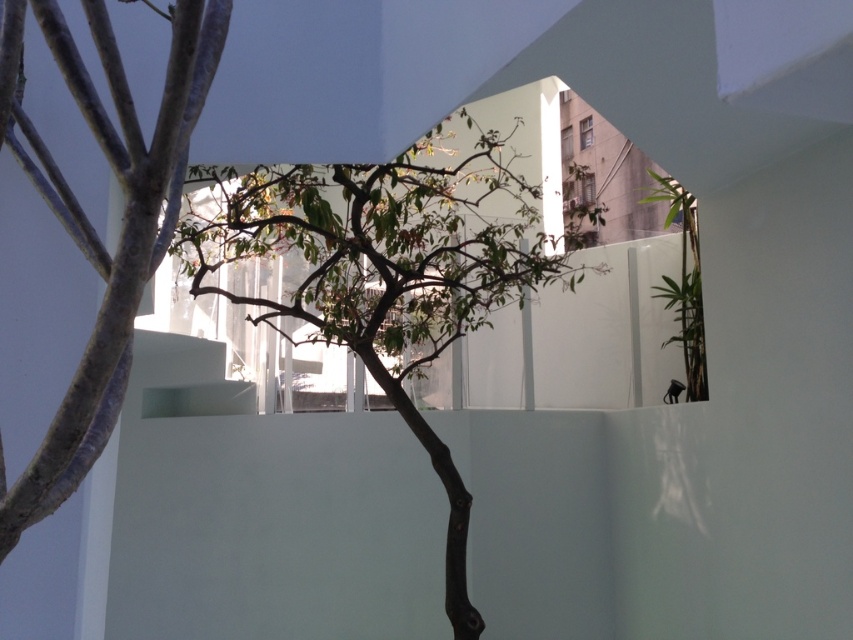
You are standing in front of the white geometric building and notice two points marked on the facade. The first point is at coordinates point (444, 300) and the second is at point (668, 392). Which point is closer to you?

Point (444, 300) is closer to the viewer than point (668, 392).

You are standing at the origin point in the image and want to walk towards the green leafy tree at center. What are the coordinates you should head towards?

The coordinates you should head towards are 0.427 on the x axis and 0.450 on the y axis.